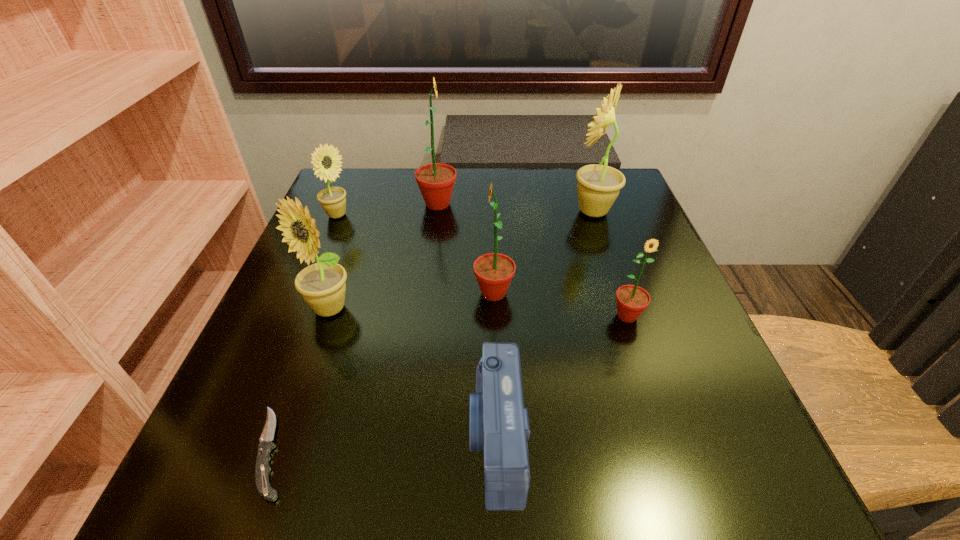
Identify the location of free space between the nearest yellow sunflower and the rightmost green sunflower. The width and height of the screenshot is (960, 540). (x=478, y=312).

You are a GUI agent. You are given a task and a screenshot of the screen. Output one action in this format:
    pyautogui.click(x=<x>, y=<y>)
    Task: Click on the vacant point located between the second smallest green sunflower and the shortest object
    The height and width of the screenshot is (540, 960).
    Given the screenshot: What is the action you would take?
    pyautogui.click(x=383, y=372)

The width and height of the screenshot is (960, 540). I want to click on vacant space in between the farthest green sunflower and the smallest green sunflower, so click(533, 260).

Locate an element on the screen. object that is the nearest to the leftmost green sunflower is located at coordinates (332, 199).

Identify which object is the closest to the camera. Please provide its 2D coordinates. Your answer should be formatted as a tuple, i.e. [(x, y)], where the tuple contains the x and y coordinates of a point satisfying the conditions above.

[(494, 272)]

Locate which sunflower is the second closest to the smallest yellow sunflower. Please provide its 2D coordinates. Your answer should be formatted as a tuple, i.e. [(x, y)], where the tuple contains the x and y coordinates of a point satisfying the conditions above.

[(322, 285)]

Find the location of `sunflower that is the third closest to the fourth sunflower from left to right`. sunflower that is the third closest to the fourth sunflower from left to right is located at coordinates (436, 181).

The image size is (960, 540). Find the location of `the closest yellow sunflower to the rightmost yellow sunflower`. the closest yellow sunflower to the rightmost yellow sunflower is located at coordinates (322, 285).

The width and height of the screenshot is (960, 540). Find the location of `yellow sunflower that stands as the second closest to the smallest yellow sunflower`. yellow sunflower that stands as the second closest to the smallest yellow sunflower is located at coordinates (598, 186).

Identify which green sunflower is the third nearest to the seventh tallest object. Please provide its 2D coordinates. Your answer should be formatted as a tuple, i.e. [(x, y)], where the tuple contains the x and y coordinates of a point satisfying the conditions above.

[(436, 181)]